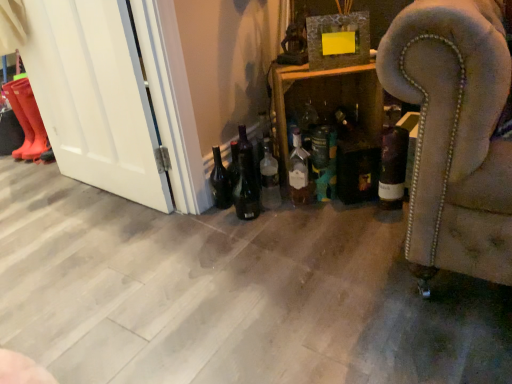
You are a GUI agent. You are given a task and a screenshot of the screen. Output one action in this format:
    pyautogui.click(x=<x>, y=<y>)
    Task: Click on the vacant space in between black glass beer bottle at lower center, acting as the first beer bottle starting from the right, and dark glass bottle at center-right, which ranks as the fifth bottle in left-to-right order
    This screenshot has height=384, width=512.
    Given the screenshot: What is the action you would take?
    pyautogui.click(x=323, y=209)